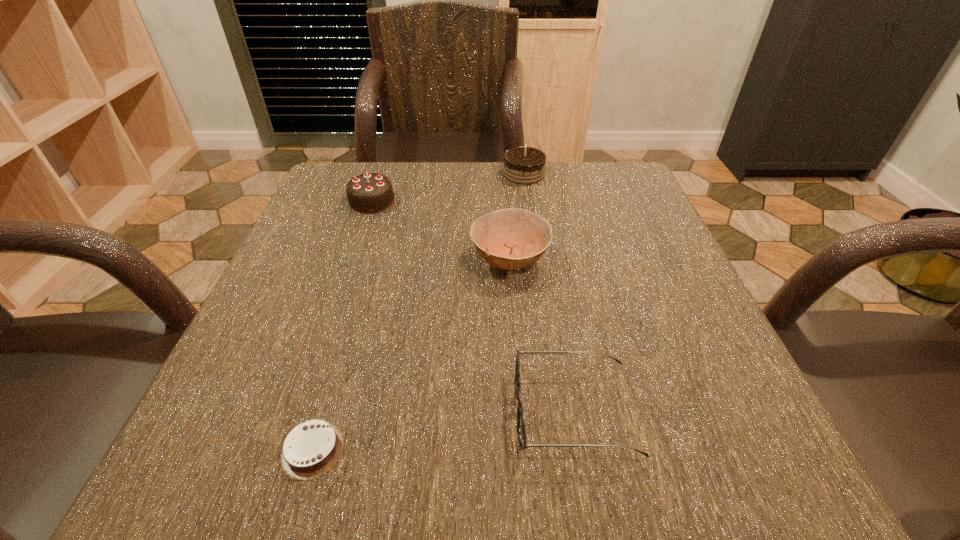
What are the coordinates of `empty space that is in between the third farthest object and the second farthest chocolate cake` in the screenshot? It's located at (441, 230).

I want to click on vacant point located between the shortest object and the bowl, so [x=411, y=354].

Where is `blank region between the third nearest object and the shortest chocolate cake`? The image size is (960, 540). blank region between the third nearest object and the shortest chocolate cake is located at coordinates pos(411,354).

The height and width of the screenshot is (540, 960). I want to click on free area in between the second shortest object and the third nearest object, so click(x=541, y=336).

Image resolution: width=960 pixels, height=540 pixels. In order to click on vacant space that's between the farthest chocolate cake and the fourth nearest object in this screenshot , I will do `click(447, 187)`.

Locate an element on the screen. Image resolution: width=960 pixels, height=540 pixels. object that stands as the third closest to the second nearest chocolate cake is located at coordinates (521, 409).

The width and height of the screenshot is (960, 540). I want to click on the closest object relative to the shortest chocolate cake, so click(x=521, y=409).

The width and height of the screenshot is (960, 540). I want to click on chocolate cake object that ranks as the closest to the rightmost chocolate cake, so click(x=372, y=192).

Identify which chocolate cake is the second closest to the spectacles. Please provide its 2D coordinates. Your answer should be formatted as a tuple, i.e. [(x, y)], where the tuple contains the x and y coordinates of a point satisfying the conditions above.

[(372, 192)]

Locate an element on the screen. free space that satisfies the following two spatial constraints: 1. on the back side of the farthest object; 2. on the right side of the fourth nearest object is located at coordinates (381, 174).